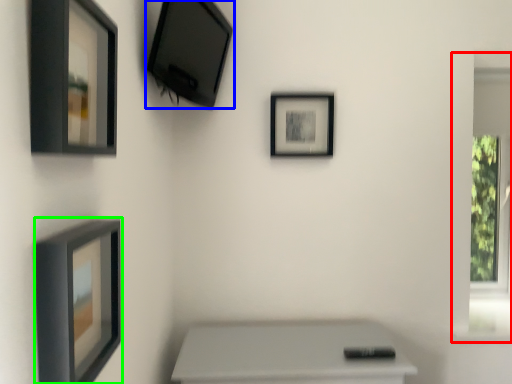
Question: Which object is the closest to the window frame (highlighted by a red box)? Choose among these: picture frame (highlighted by a blue box) or picture frame (highlighted by a green box).

Choices:
 (A) picture frame
 (B) picture frame

Answer: (A)